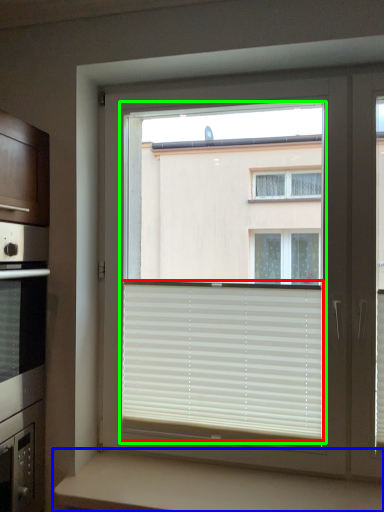
Question: Estimate the real-world distances between objects in this image. Which object is farther from window blind (highlighted by a red box), counter (highlighted by a blue box) or bay window (highlighted by a green box)?

Choices:
 (A) counter
 (B) bay window

Answer: (B)